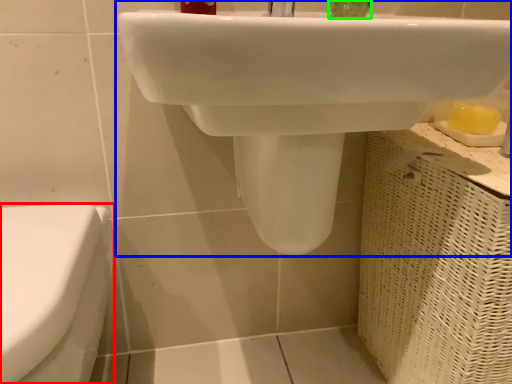
Question: Considering the real-world distances, which object is closest to toilet (highlighted by a red box)? sink (highlighted by a blue box) or liquid (highlighted by a green box).

Choices:
 (A) sink
 (B) liquid

Answer: (A)